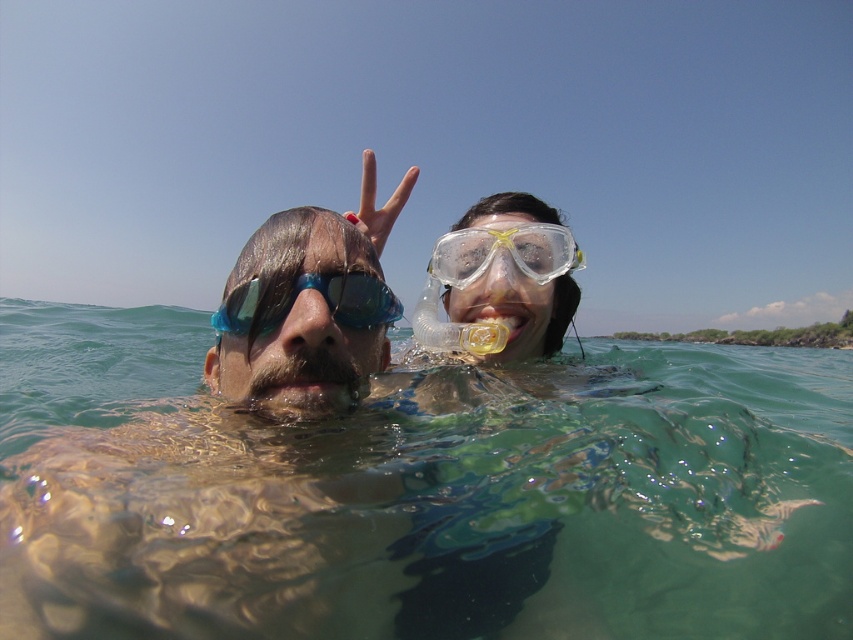
Is blue reflective goggles at center above clear plastic goggles at upper right?

Incorrect, blue reflective goggles at center is not positioned above clear plastic goggles at upper right.

Which of these two, blue reflective goggles at center or clear plastic goggles at upper right, stands taller?

Standing taller between the two is clear plastic goggles at upper right.

Find the location of a particular element. blue reflective goggles at center is located at coordinates (x=321, y=294).

Is point (136, 563) behind point (498, 234)?

No, it is in front of (498, 234).

From the picture: Does clear water at center have a lesser width compared to clear plastic goggles at upper right?

Incorrect, clear water at center's width is not less than clear plastic goggles at upper right's.

Between point (805, 556) and point (488, 248), which one is positioned behind?

The point (488, 248) is behind.

This screenshot has height=640, width=853. I want to click on clear water at center, so click(419, 497).

Can you confirm if clear water at center is positioned to the right of blue reflective goggles at center?

Yes, clear water at center is to the right of blue reflective goggles at center.

Consider the image. Is clear water at center above blue reflective goggles at center?

Incorrect, clear water at center is not positioned above blue reflective goggles at center.

Between point (694, 481) and point (374, 304), which one is positioned in front?

Point (374, 304)

The height and width of the screenshot is (640, 853). I want to click on clear water at center, so click(419, 497).